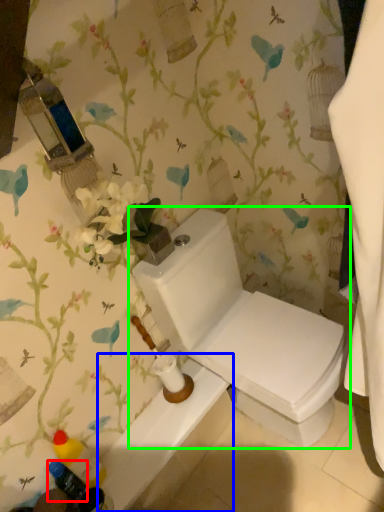
Question: Considering the real-world distances, which object is farthest from toiletry (highlighted by a red box)? bath (highlighted by a blue box) or toilet (highlighted by a green box)?

Choices:
 (A) bath
 (B) toilet

Answer: (B)